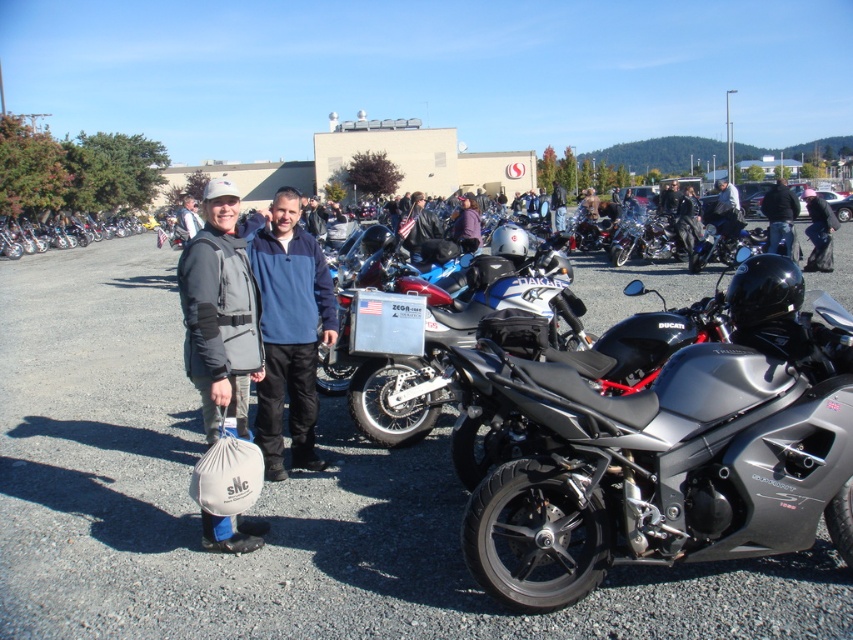
Question: Is metallic gray motorcycle at center below black leather jacket at center?

Choices:
 (A) no
 (B) yes

Answer: (B)

Question: Among these objects, which one is nearest to the camera?

Choices:
 (A) dark gray leather jacket at center
 (B) gray fabric jacket at center

Answer: (B)

Question: Which point is farther from the camera taking this photo?

Choices:
 (A) (566, 452)
 (B) (119, 416)
 (C) (788, 211)

Answer: (C)

Question: Does gray fabric jacket at center appear on the right side of black leather jacket at center?

Choices:
 (A) no
 (B) yes

Answer: (A)

Question: Is black leather jacket at center to the left of dark gray leather jacket at center from the viewer's perspective?

Choices:
 (A) no
 (B) yes

Answer: (A)

Question: Which of these objects is positioned farthest from the metallic gray motorcycle at center?

Choices:
 (A) metallic silver motorcycle at center
 (B) black leather jacket at center
 (C) dark gray leather jacket at center

Answer: (C)